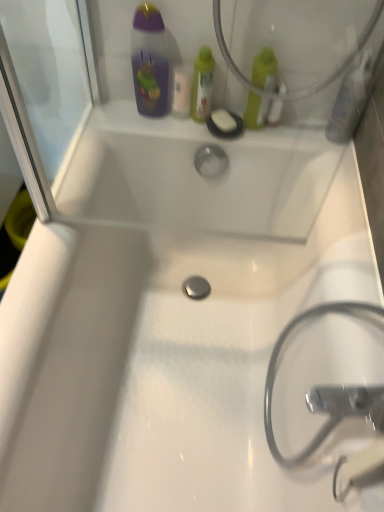
Question: From a real-world perspective, is green matte bottle at upper right, placed as the 3th mouthwash when sorted from left to right, on translucent plastic mouthwash at upper center, which appears as the fifth mouthwash when viewed from the right?

Choices:
 (A) yes
 (B) no

Answer: (A)

Question: Can you confirm if green matte bottle at upper right, arranged as the 3th mouthwash when viewed from the right, is thinner than translucent plastic mouthwash at upper center, positioned as the first mouthwash in left-to-right order?

Choices:
 (A) no
 (B) yes

Answer: (A)

Question: Does green matte bottle at upper right, arranged as the 3th mouthwash when viewed from the right, have a lesser height compared to translucent plastic mouthwash at upper center, which appears as the fifth mouthwash when viewed from the right?

Choices:
 (A) yes
 (B) no

Answer: (B)

Question: Considering the relative positions of green matte bottle at upper right, placed as the 3th mouthwash when sorted from left to right, and translucent plastic mouthwash at upper center, positioned as the first mouthwash in left-to-right order, in the image provided, is green matte bottle at upper right, placed as the 3th mouthwash when sorted from left to right, to the right of translucent plastic mouthwash at upper center, positioned as the first mouthwash in left-to-right order, from the viewer's perspective?

Choices:
 (A) no
 (B) yes

Answer: (B)

Question: Is green matte bottle at upper right, arranged as the 3th mouthwash when viewed from the right, taller than translucent plastic mouthwash at upper center, positioned as the first mouthwash in left-to-right order?

Choices:
 (A) yes
 (B) no

Answer: (A)

Question: Could you tell me if green matte bottle at upper right, arranged as the 3th mouthwash when viewed from the right, is turned towards translucent plastic mouthwash at upper center, positioned as the first mouthwash in left-to-right order?

Choices:
 (A) no
 (B) yes

Answer: (A)

Question: Is white matte soap at upper center behind metallic silver hose at lower right?

Choices:
 (A) yes
 (B) no

Answer: (A)

Question: Is white matte soap at upper center shorter than metallic silver hose at lower right?

Choices:
 (A) no
 (B) yes

Answer: (B)

Question: From the image's perspective, is white matte soap at upper center beneath metallic silver hose at lower right?

Choices:
 (A) yes
 (B) no

Answer: (B)

Question: Can you confirm if white matte soap at upper center is positioned to the left of metallic silver hose at lower right?

Choices:
 (A) yes
 (B) no

Answer: (A)

Question: From a real-world perspective, does white matte soap at upper center sit lower than metallic silver hose at lower right?

Choices:
 (A) no
 (B) yes

Answer: (B)

Question: Considering the relative positions of white matte soap at upper center and metallic silver hose at lower right in the image provided, is white matte soap at upper center to the right of metallic silver hose at lower right from the viewer's perspective?

Choices:
 (A) no
 (B) yes

Answer: (A)

Question: Is metallic silver hose at lower right positioned with its back to translucent plastic mouthwash at upper right, arranged as the first mouthwash when viewed from the right?

Choices:
 (A) no
 (B) yes

Answer: (A)